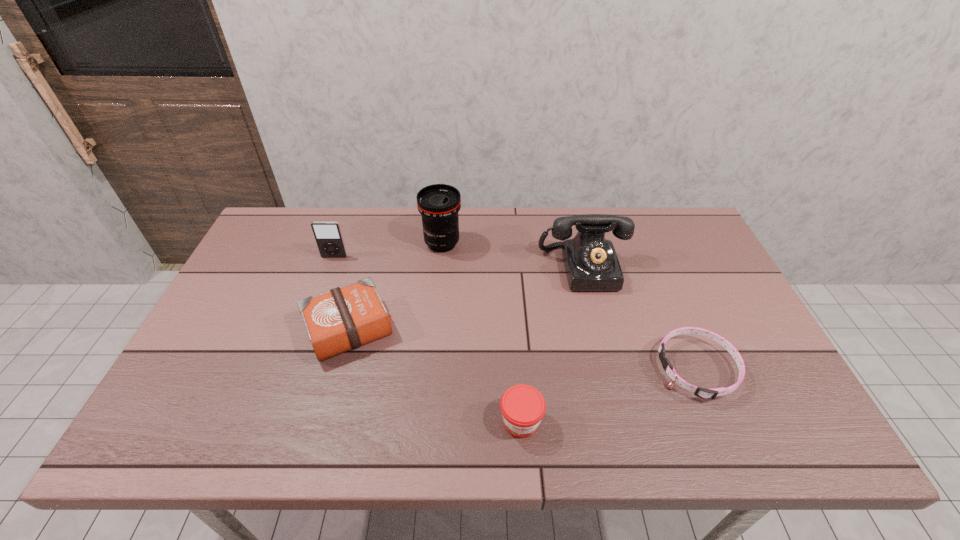
This screenshot has height=540, width=960. Identify the location of object that ranks as the fifth closest to the third object from right to left. (328, 236).

The width and height of the screenshot is (960, 540). Identify the location of object that is the fourth closest to the shortest object. (344, 318).

The image size is (960, 540). I want to click on vacant space that satisfies the following two spatial constraints: 1. on the front-facing side of the iPod; 2. on the left side of the Bible, so click(308, 329).

The image size is (960, 540). I want to click on vacant region that satisfies the following two spatial constraints: 1. on the front-facing side of the Bible; 2. on the right side of the iPod, so click(308, 329).